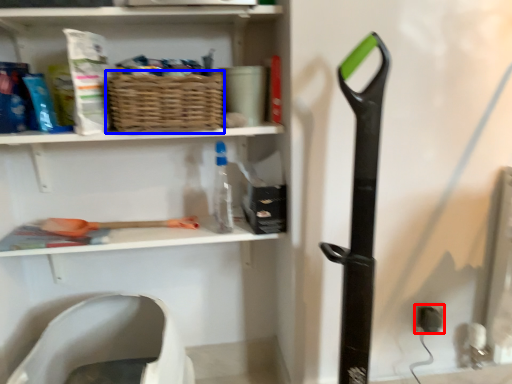
Question: Which point is further to the camera, electric outlet (highlighted by a red box) or basket (highlighted by a blue box)?

Choices:
 (A) electric outlet
 (B) basket

Answer: (A)